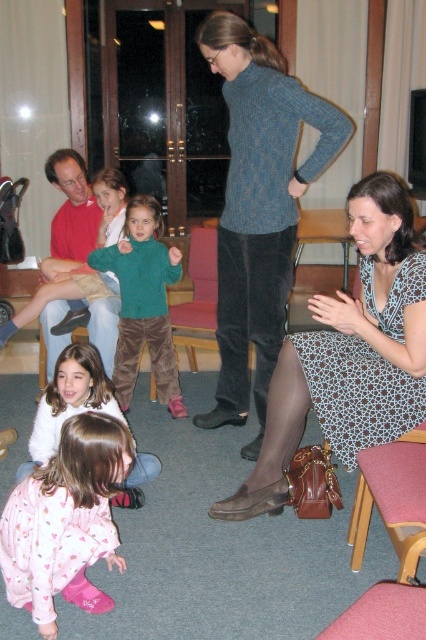
Question: Which point appears farthest from the camera in this image?

Choices:
 (A) (6, 536)
 (B) (62, 390)
 (C) (112, 332)

Answer: (C)

Question: Which of these objects is positioned farthest from the white fleece sweater at lower left?

Choices:
 (A) pink cotton pajamas at lower left
 (B) green corduroy sweater at center

Answer: (B)

Question: Does patterned fabric dress at lower right have a larger size compared to pink cotton pajamas at lower left?

Choices:
 (A) no
 (B) yes

Answer: (B)

Question: From the image, what is the correct spatial relationship of patterned fabric dress at lower right in relation to white fleece sweater at lower left?

Choices:
 (A) below
 (B) above

Answer: (B)

Question: Which is farther from the pink cotton pajamas at lower left?

Choices:
 (A) green corduroy sweater at center
 (B) matte red shirt at upper left
 (C) patterned fabric dress at lower right

Answer: (B)

Question: Can you confirm if blue knitted sweater at center is positioned below pink cotton pajamas at lower left?

Choices:
 (A) no
 (B) yes

Answer: (A)